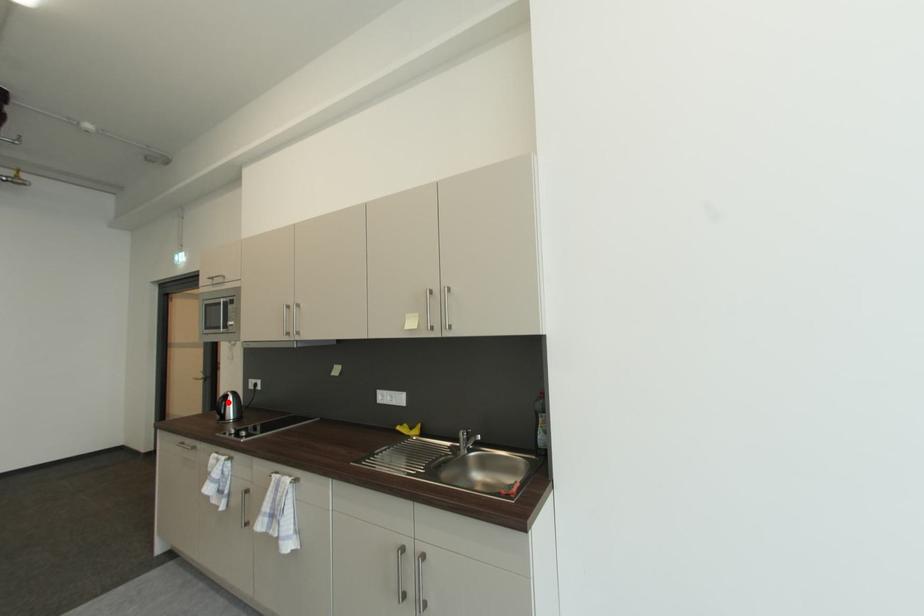
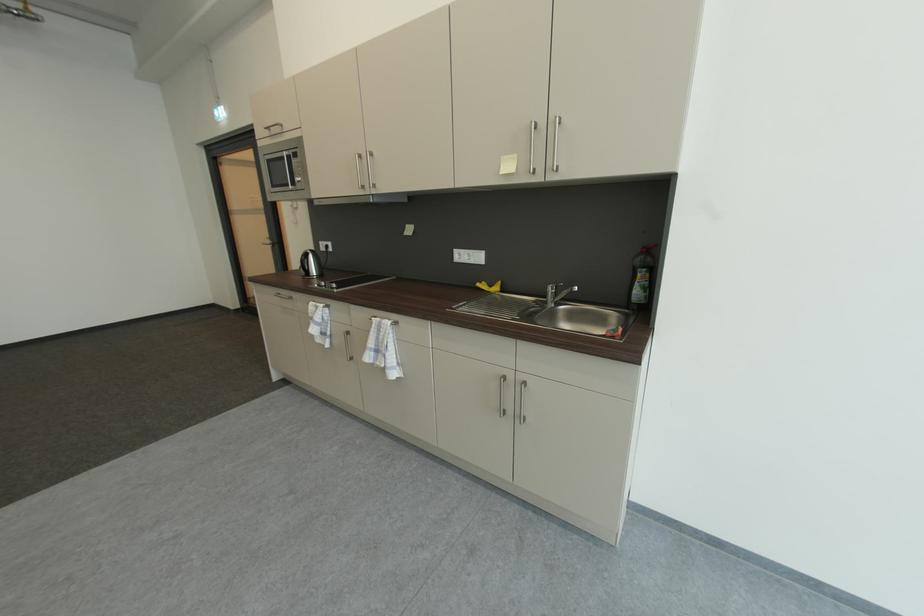
Question: I am providing you with two images of the same scene from different viewpoints. A red point is shown in image1. For the corresponding object point in image2, is it positioned nearer or farther from the camera?

Choices:
 (A) Nearer
 (B) Farther

Answer: (A)